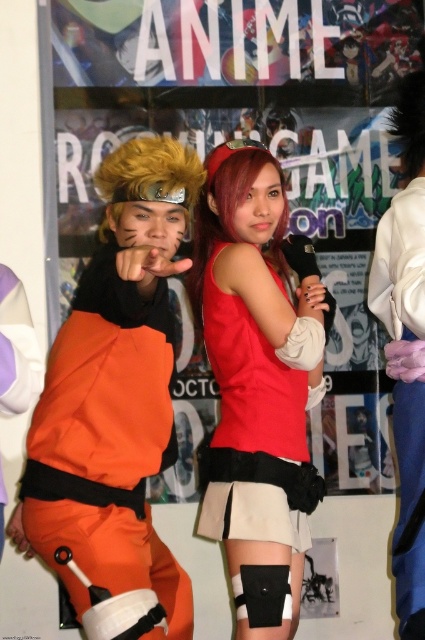
You are organizing a cosplay event and need to ensure that two participants wearing the orange fabric jumpsuit at center and the matte red tank top at center can fit side by side in a 1.5 meter wide corridor. Based on their outfit widths, can they stand next to each other without overlapping?

The orange fabric jumpsuit at center might be wider than matte red tank top at center. If the combined width of both outfits exceeds 1.5 meters, they may not fit side by side. However, since the exact widths are not provided, it is uncertain. Please measure both outfits to confirm.

You are attending a cosplay event and see two characters in the center of the stage. The orange fabric jumpsuit at center and the matte red tank top at center. Which one is positioned to the left?

The orange fabric jumpsuit at center is to the left of the matte red tank top at center.